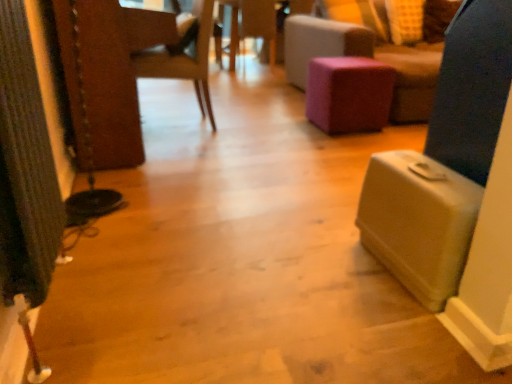
Question: Does purple fabric stool at center turn towards purple fabric ottoman at center?

Choices:
 (A) yes
 (B) no

Answer: (A)

Question: From a real-world perspective, is purple fabric stool at center over purple fabric ottoman at center?

Choices:
 (A) no
 (B) yes

Answer: (A)

Question: Can you confirm if purple fabric stool at center is taller than purple fabric ottoman at center?

Choices:
 (A) no
 (B) yes

Answer: (A)

Question: Is purple fabric ottoman at center inside purple fabric stool at center?

Choices:
 (A) no
 (B) yes

Answer: (A)

Question: Can you confirm if purple fabric stool at center is shorter than purple fabric ottoman at center?

Choices:
 (A) no
 (B) yes

Answer: (B)

Question: Is purple fabric stool at center next to purple fabric ottoman at center?

Choices:
 (A) no
 (B) yes

Answer: (A)

Question: Does wooden side table at center appear on the right side of purple fabric ottoman at center?

Choices:
 (A) no
 (B) yes

Answer: (A)

Question: From the image's perspective, is wooden side table at center on top of purple fabric ottoman at center?

Choices:
 (A) no
 (B) yes

Answer: (B)

Question: Is wooden side table at center aimed at purple fabric ottoman at center?

Choices:
 (A) no
 (B) yes

Answer: (A)

Question: Is wooden side table at center outside of purple fabric ottoman at center?

Choices:
 (A) yes
 (B) no

Answer: (A)

Question: Are wooden side table at center and purple fabric ottoman at center located far from each other?

Choices:
 (A) no
 (B) yes

Answer: (B)

Question: Considering the relative sizes of wooden side table at center and purple fabric ottoman at center in the image provided, is wooden side table at center shorter than purple fabric ottoman at center?

Choices:
 (A) yes
 (B) no

Answer: (A)

Question: From the image's perspective, does wooden chair at center appear higher than wooden side table at center?

Choices:
 (A) no
 (B) yes

Answer: (A)